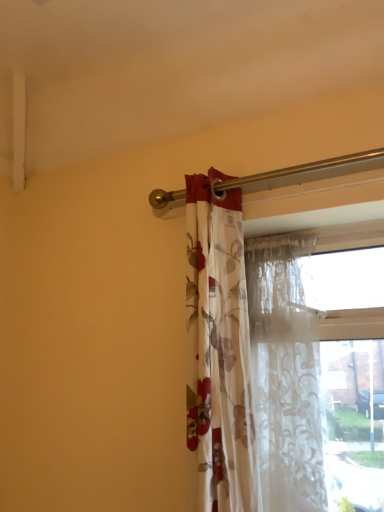
What is the approximate height of translucent floral fabric at center, arranged as the second curtain when viewed from the left?

translucent floral fabric at center, arranged as the second curtain when viewed from the left, is 32.04 inches tall.

Find the location of a particular element. translucent floral fabric at center, acting as the 1th curtain starting from the right is located at coordinates (285, 376).

This screenshot has width=384, height=512. Describe the element at coordinates (285, 376) in the screenshot. I see `translucent floral fabric at center, arranged as the second curtain when viewed from the left` at that location.

Find the location of a particular element. The image size is (384, 512). floral fabric curtain at center, placed as the 1th curtain when sorted from left to right is located at coordinates (248, 365).

Describe the element at coordinates (248, 365) in the screenshot. The width and height of the screenshot is (384, 512). I see `floral fabric curtain at center, the second curtain from the right` at that location.

In order to click on translucent floral fabric at center, acting as the 1th curtain starting from the right in this screenshot , I will do coord(285,376).

Which is more to the right, floral fabric curtain at center, the second curtain from the right, or translucent floral fabric at center, arranged as the second curtain when viewed from the left?

translucent floral fabric at center, arranged as the second curtain when viewed from the left.

Which is behind, floral fabric curtain at center, the second curtain from the right, or translucent floral fabric at center, acting as the 1th curtain starting from the right?

translucent floral fabric at center, acting as the 1th curtain starting from the right, is behind.

Considering the positions of point (300, 473) and point (279, 367), is point (300, 473) closer or farther from the camera than point (279, 367)?

Point (300, 473) is closer to the camera than point (279, 367).

From the image's perspective, does floral fabric curtain at center, the second curtain from the right, appear higher than translucent floral fabric at center, arranged as the second curtain when viewed from the left?

Yes, from the image's perspective, floral fabric curtain at center, the second curtain from the right, is above translucent floral fabric at center, arranged as the second curtain when viewed from the left.

Based on the photo, from a real-world perspective, is floral fabric curtain at center, the second curtain from the right, beneath translucent floral fabric at center, acting as the 1th curtain starting from the right?

Incorrect, from a real-world perspective, floral fabric curtain at center, the second curtain from the right, is higher than translucent floral fabric at center, acting as the 1th curtain starting from the right.

Does floral fabric curtain at center, the second curtain from the right, have a lesser width compared to translucent floral fabric at center, arranged as the second curtain when viewed from the left?

No.

From the picture: Is floral fabric curtain at center, placed as the 1th curtain when sorted from left to right, taller or shorter than translucent floral fabric at center, acting as the 1th curtain starting from the right?

Clearly, floral fabric curtain at center, placed as the 1th curtain when sorted from left to right, is taller compared to translucent floral fabric at center, acting as the 1th curtain starting from the right.

Does floral fabric curtain at center, the second curtain from the right, have a smaller size compared to translucent floral fabric at center, arranged as the second curtain when viewed from the left?

Incorrect, floral fabric curtain at center, the second curtain from the right, is not smaller in size than translucent floral fabric at center, arranged as the second curtain when viewed from the left.

Is translucent floral fabric at center, arranged as the second curtain when viewed from the left, inside floral fabric curtain at center, the second curtain from the right?

Actually, translucent floral fabric at center, arranged as the second curtain when viewed from the left, is outside floral fabric curtain at center, the second curtain from the right.

Would you say floral fabric curtain at center, placed as the 1th curtain when sorted from left to right, is a long distance from translucent floral fabric at center, arranged as the second curtain when viewed from the left?

No.

Is floral fabric curtain at center, the second curtain from the right, oriented away from translucent floral fabric at center, arranged as the second curtain when viewed from the left?

Yes, floral fabric curtain at center, the second curtain from the right, is positioned with its back facing translucent floral fabric at center, arranged as the second curtain when viewed from the left.

Based on the photo, measure the distance between floral fabric curtain at center, placed as the 1th curtain when sorted from left to right, and translucent floral fabric at center, arranged as the second curtain when viewed from the left.

floral fabric curtain at center, placed as the 1th curtain when sorted from left to right, and translucent floral fabric at center, arranged as the second curtain when viewed from the left, are 3.41 inches apart from each other.

The width and height of the screenshot is (384, 512). Identify the location of curtain behind the floral fabric curtain at center, placed as the 1th curtain when sorted from left to right. (285, 376).

Considering the relative positions of translucent floral fabric at center, arranged as the second curtain when viewed from the left, and floral fabric curtain at center, the second curtain from the right, in the image provided, is translucent floral fabric at center, arranged as the second curtain when viewed from the left, to the right of floral fabric curtain at center, the second curtain from the right, from the viewer's perspective?

Yes.

Relative to floral fabric curtain at center, the second curtain from the right, is translucent floral fabric at center, acting as the 1th curtain starting from the right, in front or behind?

In the image, translucent floral fabric at center, acting as the 1th curtain starting from the right, appears behind floral fabric curtain at center, the second curtain from the right.

Which is behind, point (293, 404) or point (295, 397)?

The point (295, 397) is behind.

From the image's perspective, is translucent floral fabric at center, acting as the 1th curtain starting from the right, located above or below floral fabric curtain at center, placed as the 1th curtain when sorted from left to right?

From the image's perspective, translucent floral fabric at center, acting as the 1th curtain starting from the right, appears below floral fabric curtain at center, placed as the 1th curtain when sorted from left to right.

From a real-world perspective, which object stands above the other?

floral fabric curtain at center, placed as the 1th curtain when sorted from left to right, is physically above.

Between translucent floral fabric at center, acting as the 1th curtain starting from the right, and floral fabric curtain at center, the second curtain from the right, which one has smaller width?

With smaller width is translucent floral fabric at center, acting as the 1th curtain starting from the right.

Considering the sizes of objects translucent floral fabric at center, arranged as the second curtain when viewed from the left, and floral fabric curtain at center, placed as the 1th curtain when sorted from left to right, in the image provided, who is taller, translucent floral fabric at center, arranged as the second curtain when viewed from the left, or floral fabric curtain at center, placed as the 1th curtain when sorted from left to right,?

With more height is floral fabric curtain at center, placed as the 1th curtain when sorted from left to right.

Considering the sizes of objects translucent floral fabric at center, arranged as the second curtain when viewed from the left, and floral fabric curtain at center, the second curtain from the right, in the image provided, who is bigger, translucent floral fabric at center, arranged as the second curtain when viewed from the left, or floral fabric curtain at center, the second curtain from the right,?

floral fabric curtain at center, the second curtain from the right.

Is floral fabric curtain at center, the second curtain from the right, a part of translucent floral fabric at center, acting as the 1th curtain starting from the right?

No, floral fabric curtain at center, the second curtain from the right, is located outside of translucent floral fabric at center, acting as the 1th curtain starting from the right.

Is translucent floral fabric at center, arranged as the second curtain when viewed from the left, far away from floral fabric curtain at center, placed as the 1th curtain when sorted from left to right?

Actually, translucent floral fabric at center, arranged as the second curtain when viewed from the left, and floral fabric curtain at center, placed as the 1th curtain when sorted from left to right, are a little close together.

Is floral fabric curtain at center, the second curtain from the right, at the back of translucent floral fabric at center, arranged as the second curtain when viewed from the left?

No, translucent floral fabric at center, arranged as the second curtain when viewed from the left, is not facing the opposite direction of floral fabric curtain at center, the second curtain from the right.

Can you tell me how much translucent floral fabric at center, arranged as the second curtain when viewed from the left, and floral fabric curtain at center, placed as the 1th curtain when sorted from left to right, differ in facing direction?

There is a 0.261-degree angle between the facing directions of translucent floral fabric at center, arranged as the second curtain when viewed from the left, and floral fabric curtain at center, placed as the 1th curtain when sorted from left to right.

Where is `curtain on the right of floral fabric curtain at center, placed as the 1th curtain when sorted from left to right`? The width and height of the screenshot is (384, 512). curtain on the right of floral fabric curtain at center, placed as the 1th curtain when sorted from left to right is located at coordinates (285, 376).

Identify the location of curtain on the right of floral fabric curtain at center, the second curtain from the right. (285, 376).

Locate an element on the screen. This screenshot has height=512, width=384. curtain above the translucent floral fabric at center, acting as the 1th curtain starting from the right (from a real-world perspective) is located at coordinates (248, 365).